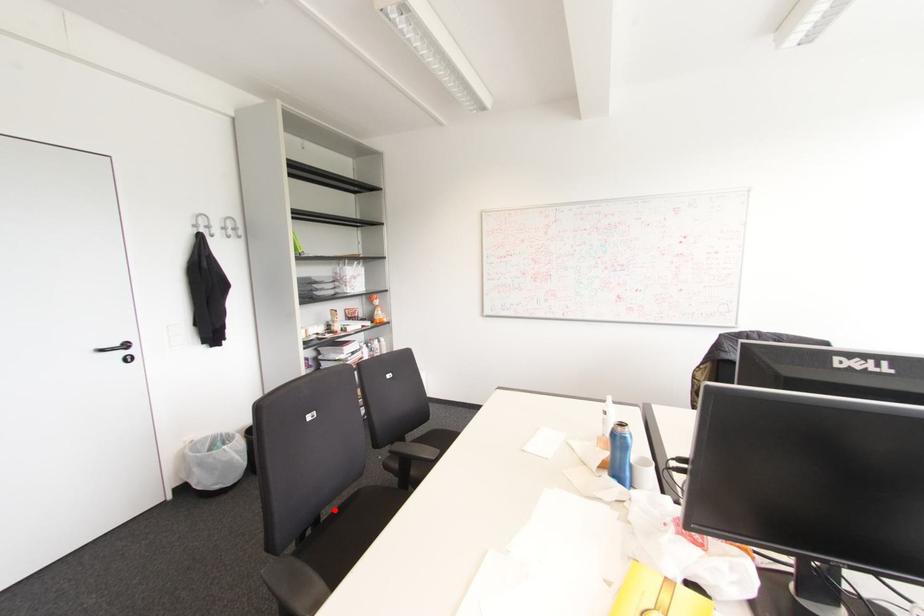
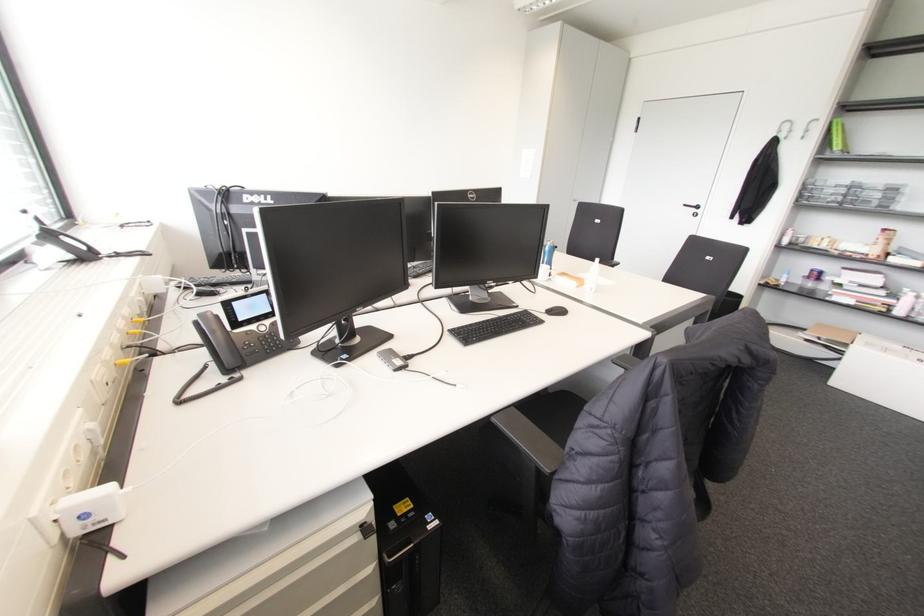
Question: I am providing you with two images of the same scene from different viewpoints. A red point is marked on the first image. At the location where the point appears in image 1, is it still visible in image 2?

Choices:
 (A) Yes
 (B) No

Answer: (B)